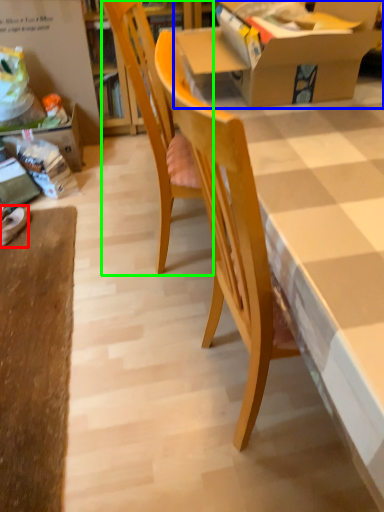
Question: Which object is positioned farthest from footwear (highlighted by a red box)? Select from box (highlighted by a blue box) and chair (highlighted by a green box).

Choices:
 (A) box
 (B) chair

Answer: (A)